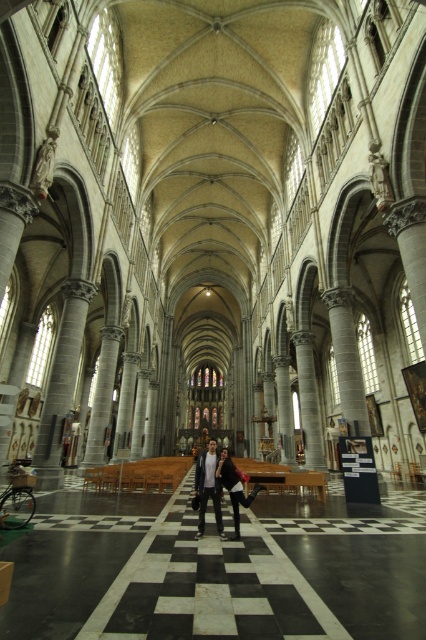
You are standing at the entrance of the cathedral and see the point marked by coordinates point (x=221, y=486). What object is located at that point?

The point (x=221, y=486) corresponds to the location of the matte black jacket at center.

You are a photographer standing in the cathedral. You want to capture both the matte black jacket at center and the white shirt at center in the same frame without moving the camera. Can you fit both items in the frame if the camera has a standard 50mm lens?

The matte black jacket at center might be wider than white shirt at center, so it depends on their actual widths. If the jacket is wider, it may occupy more space in the frame, but since both are at the same center position, they should be visible together unless the jacket completely obscures the shirt.